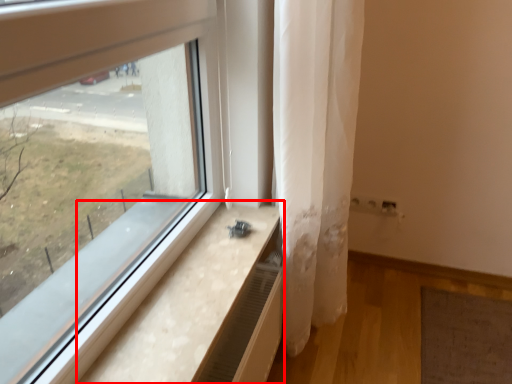
Question: From the image's perspective, what is the correct spatial positioning of window sill (annotated by the red box) in reference to curtain?

Choices:
 (A) below
 (B) above

Answer: (A)